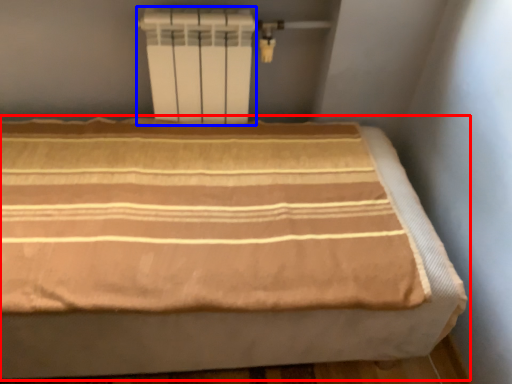
Question: Among these objects, which one is farthest to the camera, bed (highlighted by a red box) or water heater (highlighted by a blue box)?

Choices:
 (A) bed
 (B) water heater

Answer: (B)